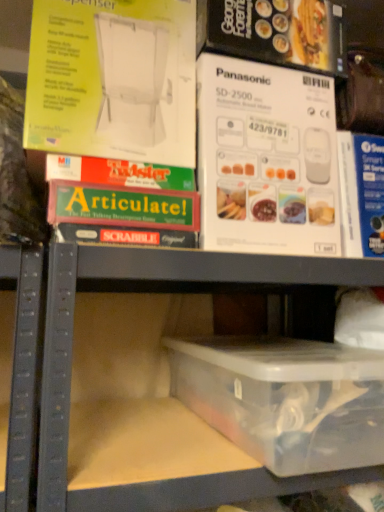
You are a GUI agent. You are given a task and a screenshot of the screen. Output one action in this format:
    pyautogui.click(x=<x>, y=<y>)
    Task: Click on the transparent plastic container at lower center
    The width and height of the screenshot is (384, 512).
    Given the screenshot: What is the action you would take?
    pyautogui.click(x=146, y=395)

The width and height of the screenshot is (384, 512). What do you see at coordinates (113, 80) in the screenshot?
I see `green matte board game at upper left` at bounding box center [113, 80].

The width and height of the screenshot is (384, 512). What are the coordinates of `transparent plastic container at lower center` in the screenshot? It's located at (146, 395).

Is the depth of green matte board game at upper left greater than that of transparent plastic container at lower center?

Yes, it is behind transparent plastic container at lower center.

Who is bigger, green matte board game at upper left or transparent plastic container at lower center?

transparent plastic container at lower center is bigger.

Identify the location of paperback book lying on the left of transparent plastic container at lower center. (113, 80).

Could you tell me if green matte board game at upper left is facing transparent plastic container at lower center?

No, green matte board game at upper left is not turned towards transparent plastic container at lower center.

From the image's perspective, which is above, transparent plastic container at lower center or green matte board game at upper left?

green matte board game at upper left.

Are transparent plastic container at lower center and green matte board game at upper left beside each other?

They are not placed beside each other.

Can you tell me how much transparent plastic container at lower center and green matte board game at upper left differ in facing direction?

They differ by 1.33 degrees in their facing directions.

Considering the relative sizes of transparent plastic container at lower center and green matte board game at upper left in the image provided, is transparent plastic container at lower center thinner than green matte board game at upper left?

In fact, transparent plastic container at lower center might be wider than green matte board game at upper left.

Is transparent plastic container at lower center bigger than green matte board game at upper left?

Yes.

Considering the positions of point (296, 462) and point (128, 32), is point (296, 462) closer or farther from the camera than point (128, 32)?

Clearly, point (296, 462) is closer to the camera than point (128, 32).

From a real-world perspective, is transparent plastic container at lower center positioned under green matte board game at upper left based on gravity?

Yes.

Is green matte board game at upper left at the back of transparent plastic container at lower center?

No, transparent plastic container at lower center is not facing the opposite direction of green matte board game at upper left.

From the image's perspective, is green matte board game at upper left below transparent plastic container at lower center?

No, from the image's perspective, green matte board game at upper left is not below transparent plastic container at lower center.

Is point (47, 127) behind point (362, 353)?

No, it is in front of (362, 353).

How different are the orientations of green matte board game at upper left and transparent plastic container at lower center in degrees?

The angular difference between green matte board game at upper left and transparent plastic container at lower center is 4.9 degrees.

From a real-world perspective, is green matte board game at upper left on top of transparent plastic container at lower center?

Yes, from a real-world perspective, green matte board game at upper left is above transparent plastic container at lower center.

Could you measure the distance between transparent plastic container at lower center and transparent plastic container at lower center?

The distance of transparent plastic container at lower center from transparent plastic container at lower center is 13.07 centimeters.

Is transparent plastic container at lower center oriented away from transparent plastic container at lower center?

Yes, transparent plastic container at lower center is at the back of transparent plastic container at lower center.

Considering the positions of objects transparent plastic container at lower center and transparent plastic container at lower center in the image provided, who is more to the left, transparent plastic container at lower center or transparent plastic container at lower center?

From the viewer's perspective, transparent plastic container at lower center appears more on the left side.

From a real-world perspective, is transparent plastic container at lower center above or below transparent plastic container at lower center?

In terms of real-world spatial position, transparent plastic container at lower center is below transparent plastic container at lower center.

Considering the positions of objects transparent plastic container at lower center and transparent plastic container at lower center in the image provided, who is more to the right, transparent plastic container at lower center or transparent plastic container at lower center?

transparent plastic container at lower center is more to the right.

Does transparent plastic container at lower center touch transparent plastic container at lower center?

There is a gap between transparent plastic container at lower center and transparent plastic container at lower center.

Considering the relative positions of transparent plastic container at lower center and transparent plastic container at lower center in the image provided, is transparent plastic container at lower center in front of transparent plastic container at lower center?

No, transparent plastic container at lower center is further to the viewer.

Is transparent plastic container at lower center smaller than transparent plastic container at lower center?

Yes.

You are a GUI agent. You are given a task and a screenshot of the screen. Output one action in this format:
    pyautogui.click(x=<x>, y=<y>)
    Task: Click on the paperback book behind the transparent plastic container at lower center
    
    Given the screenshot: What is the action you would take?
    pyautogui.click(x=113, y=80)

At what (x,y) coordinates should I click in order to perform the action: click on shelf that appears in front of the green matte board game at upper left. Please return your answer as a coordinate pair (x, y). Looking at the image, I should click on click(x=146, y=395).

Which object lies nearer to the anchor point transparent plastic container at lower center, green matte board game at upper left or transparent plastic container at lower center?

transparent plastic container at lower center.

When comparing their distances from transparent plastic container at lower center, does transparent plastic container at lower center or green matte board game at upper left seem closer?

The object closer to transparent plastic container at lower center is transparent plastic container at lower center.

From the picture: Considering their positions, is transparent plastic container at lower center positioned closer to green matte board game at upper left than transparent plastic container at lower center?

The object closer to green matte board game at upper left is transparent plastic container at lower center.

Based on their spatial positions, is transparent plastic container at lower center or transparent plastic container at lower center closer to green matte board game at upper left?

Among the two, transparent plastic container at lower center is located nearer to green matte board game at upper left.

When comparing their distances from transparent plastic container at lower center, does green matte board game at upper left or transparent plastic container at lower center seem closer?

transparent plastic container at lower center is closer to transparent plastic container at lower center.

When comparing their distances from transparent plastic container at lower center, does transparent plastic container at lower center or green matte board game at upper left seem further?

The object further to transparent plastic container at lower center is green matte board game at upper left.

Where is `box that lies between green matte board game at upper left and transparent plastic container at lower center from top to bottom`? The width and height of the screenshot is (384, 512). box that lies between green matte board game at upper left and transparent plastic container at lower center from top to bottom is located at coordinates (286, 400).